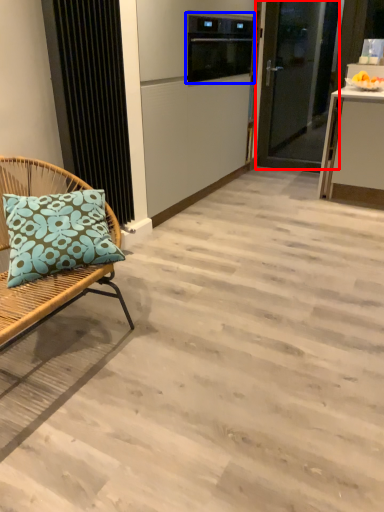
Question: Which point is further to the camera, door (highlighted by a red box) or appliance (highlighted by a blue box)?

Choices:
 (A) door
 (B) appliance

Answer: (A)